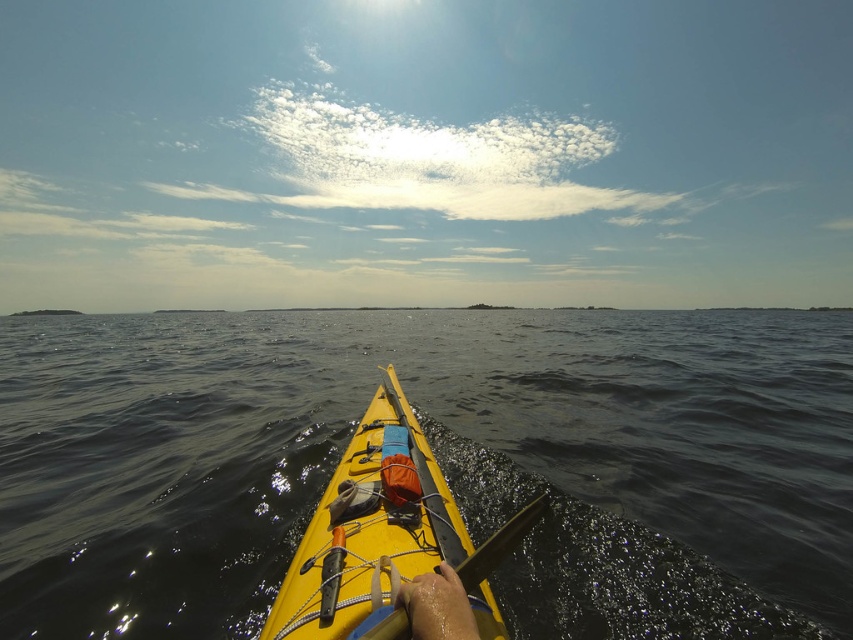
Does yellow matte kayak at center come in front of smooth wood paddle at center?

Yes, it is in front of smooth wood paddle at center.

Does yellow matte kayak at center have a greater width compared to smooth wood paddle at center?

Indeed, yellow matte kayak at center has a greater width compared to smooth wood paddle at center.

Where is `yellow matte kayak at center`? yellow matte kayak at center is located at coordinates (367, 531).

What do you see at coordinates (436, 460) in the screenshot? This screenshot has height=640, width=853. I see `dark blue water at center` at bounding box center [436, 460].

Can you confirm if dark blue water at center is positioned to the left of yellow matte kayak at center?

No, dark blue water at center is not to the left of yellow matte kayak at center.

Which is in front, point (534, 342) or point (375, 516)?

Point (375, 516) is in front.

You are a GUI agent. You are given a task and a screenshot of the screen. Output one action in this format:
    pyautogui.click(x=<x>, y=<y>)
    Task: Click on the dark blue water at center
    The height and width of the screenshot is (640, 853).
    Given the screenshot: What is the action you would take?
    pyautogui.click(x=436, y=460)

Which of these two, dark blue water at center or smooth wood paddle at center, stands taller?

dark blue water at center

Which of these two, dark blue water at center or smooth wood paddle at center, stands shorter?

smooth wood paddle at center

Does point (86, 340) come behind point (490, 547)?

Yes, it is behind point (490, 547).

What are the coordinates of `dark blue water at center` in the screenshot? It's located at (436, 460).